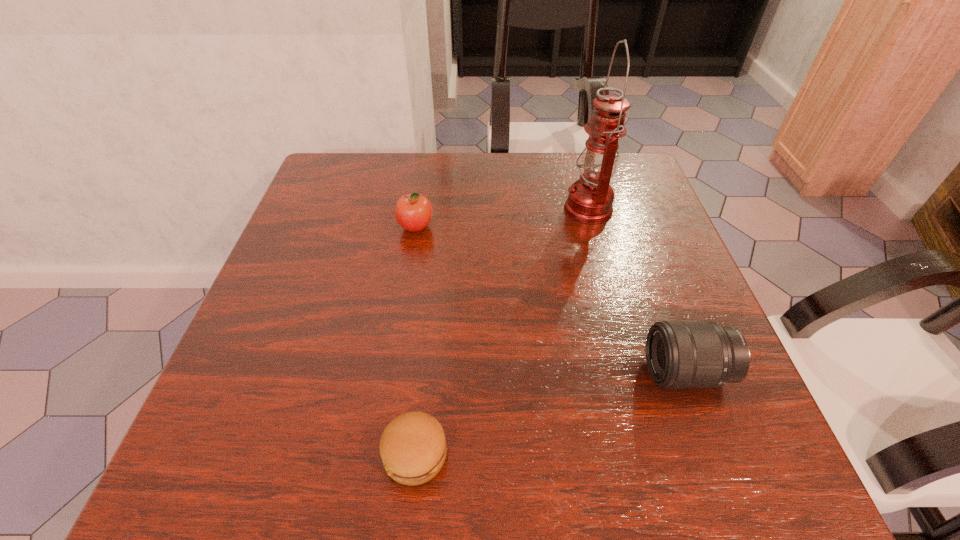
The width and height of the screenshot is (960, 540). In order to click on oil lamp in this screenshot , I will do (x=590, y=200).

Find the location of a particular element. This screenshot has height=540, width=960. apple is located at coordinates (413, 211).

Identify the location of the second nearest object. The height and width of the screenshot is (540, 960). (680, 354).

At what (x,y) coordinates should I click in order to perform the action: click on the nearest object. Please return your answer as a coordinate pair (x, y). This screenshot has height=540, width=960. Looking at the image, I should click on (413, 449).

Find the location of `hamburger`. hamburger is located at coordinates (413, 449).

At what (x,y) coordinates should I click in order to perform the action: click on vacant region located on the left of the oil lamp. Please return your answer as a coordinate pair (x, y). Image resolution: width=960 pixels, height=540 pixels. Looking at the image, I should click on (493, 208).

Locate an element on the screen. vacant area located on the right of the apple is located at coordinates (525, 227).

Locate an element on the screen. This screenshot has width=960, height=540. blank area located on the surface of the third farthest object is located at coordinates (429, 372).

In order to click on free region located on the surface of the third farthest object in this screenshot , I will do `click(505, 372)`.

What are the coordinates of `free point located 0.300m on the surface of the third farthest object` in the screenshot? It's located at (469, 372).